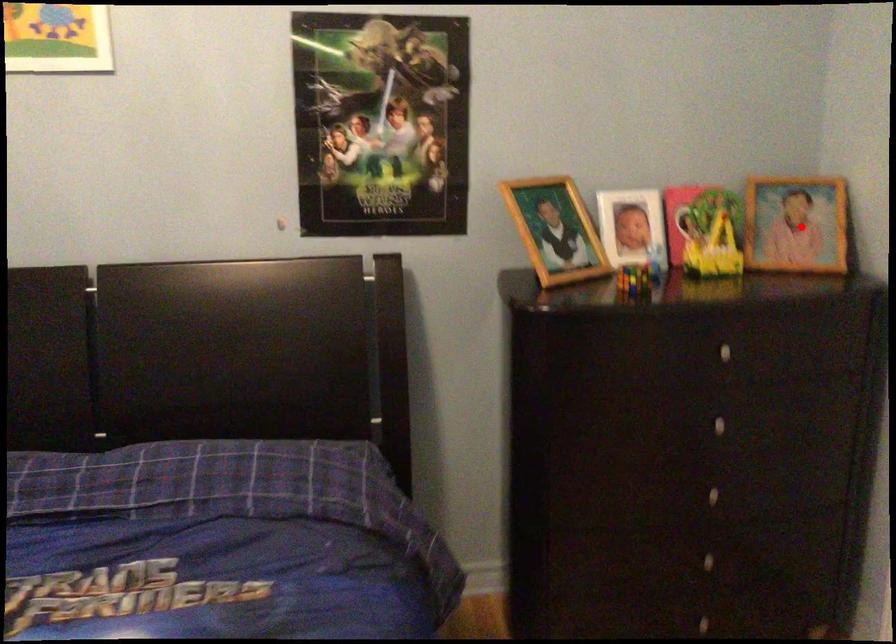
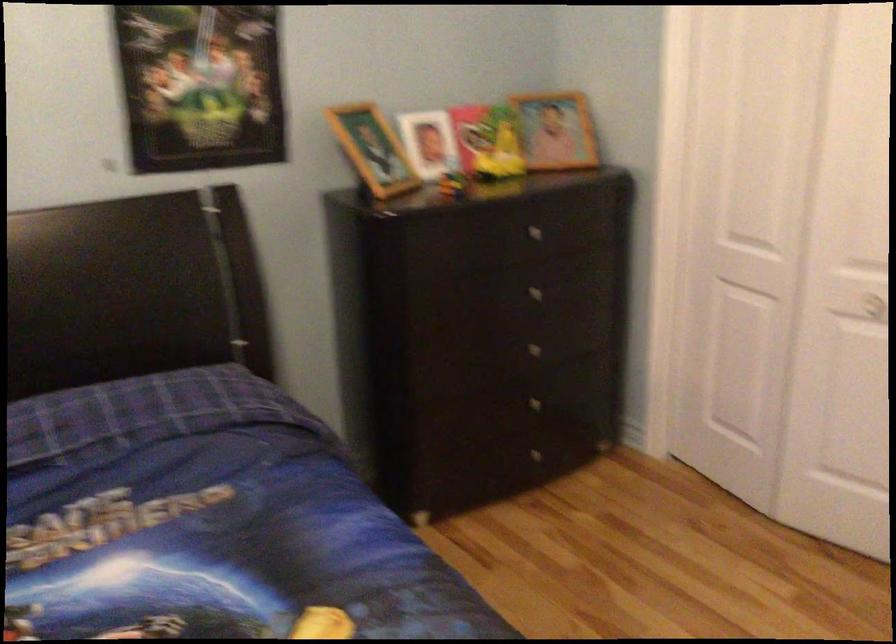
Locate, in the second image, the point that corresponds to the highlighted location in the first image.

(556, 129)